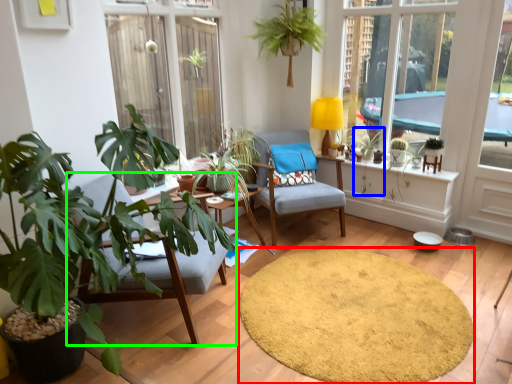
Question: Considering the real-world distances, which object is closest to mat (highlighted by a red box)? plant (highlighted by a blue box) or chair (highlighted by a green box).

Choices:
 (A) plant
 (B) chair

Answer: (B)